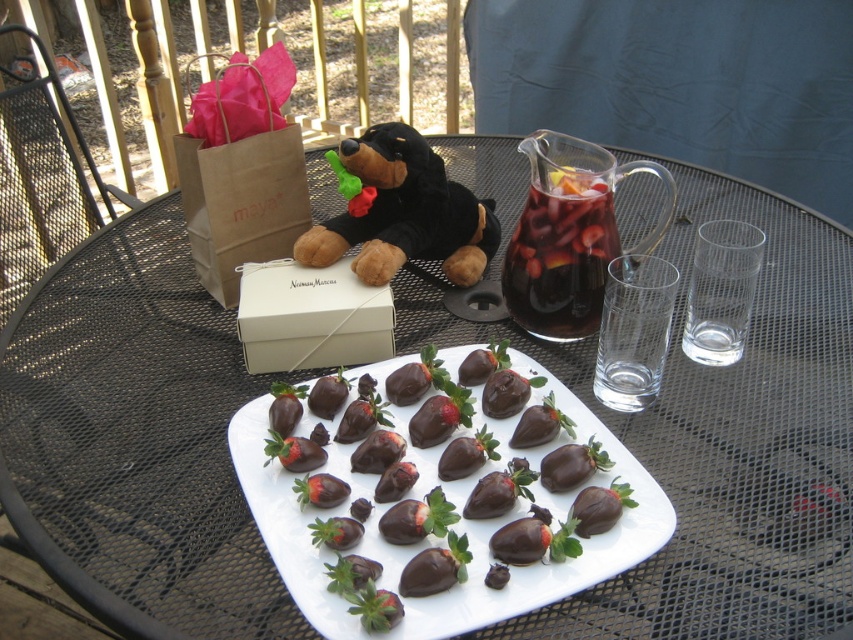
Question: Is chocolate-coated strawberries at center to the left of dark glass pitcher at upper center from the viewer's perspective?

Choices:
 (A) yes
 (B) no

Answer: (A)

Question: Among these objects, which one is nearest to the camera?

Choices:
 (A) black plush bear at center
 (B) dark glass pitcher at upper center
 (C) white paper box at center

Answer: (B)

Question: Can you confirm if chocolate-coated strawberries at center is thinner than dark glass pitcher at upper center?

Choices:
 (A) yes
 (B) no

Answer: (B)

Question: Observing the image, what is the correct spatial positioning of chocolate-coated strawberries at center in reference to white paper box at center?

Choices:
 (A) above
 (B) below

Answer: (B)

Question: Among these objects, which one is farthest from the camera?

Choices:
 (A) black plush bear at center
 (B) chocolate-coated strawberries at center

Answer: (A)

Question: Which point is closer to the camera?

Choices:
 (A) (584, 284)
 (B) (457, 433)

Answer: (B)